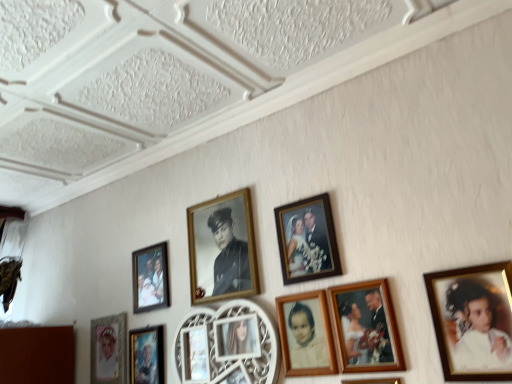
How much space does metallic silver portrait at lower left, the sixth picture frame when ordered from right to left, occupy vertically?

8.64 inches.

Describe the element at coordinates (373, 381) in the screenshot. This screenshot has height=384, width=512. I see `wooden photo frame at lower center, the first picture frame in the right-to-left sequence` at that location.

The height and width of the screenshot is (384, 512). In order to click on gold-framed photo at center, which ranks as the 4th picture frame in left-to-right order in this screenshot , I will do `click(222, 248)`.

What do you see at coordinates (477, 327) in the screenshot?
I see `matte gold frame at upper right` at bounding box center [477, 327].

What do you see at coordinates (247, 340) in the screenshot?
I see `white wood photo frame at center, acting as the fourth picture frame starting from the right` at bounding box center [247, 340].

Where is `white wood photo frame at center, the 5th picture frame when ordered from left to right`? The image size is (512, 384). white wood photo frame at center, the 5th picture frame when ordered from left to right is located at coordinates pyautogui.click(x=247, y=340).

Image resolution: width=512 pixels, height=384 pixels. I want to click on metallic silver portrait at lower left, the sixth picture frame when ordered from right to left, so click(146, 355).

Is point (391, 382) closer or farther from the camera than point (401, 362)?

Point (391, 382) is farther from the camera than point (401, 362).

From the image's perspective, would you say wooden photo frame at lower center, the 8th picture frame viewed from the left, is positioned over wooden photo frame at center, which is the 7th picture frame in left-to-right order?

No, from the image's perspective, wooden photo frame at lower center, the 8th picture frame viewed from the left, is not above wooden photo frame at center, which is the 7th picture frame in left-to-right order.

Which object is closer to the camera taking this photo, wooden photo frame at lower center, the first picture frame in the right-to-left sequence, or wooden photo frame at center, which is the 7th picture frame in left-to-right order?

Positioned in front is wooden photo frame at lower center, the first picture frame in the right-to-left sequence.

Which is nearer, (467, 280) or (257, 308)?

Point (467, 280) appears to be closer to the viewer than point (257, 308).

Based on their positions, is matte gold frame at upper right located to the left or right of white wood photo frame at center, acting as the fourth picture frame starting from the right?

matte gold frame at upper right is to the right of white wood photo frame at center, acting as the fourth picture frame starting from the right.

Consider the image. Looking at their sizes, would you say matte gold frame at upper right is wider or thinner than white wood photo frame at center, acting as the fourth picture frame starting from the right?

Clearly, matte gold frame at upper right has less width compared to white wood photo frame at center, acting as the fourth picture frame starting from the right.

Which object is wider, wooden photo frame at lower center, the first picture frame in the right-to-left sequence, or matte wooden picture frame at lower left, which appears as the second picture frame when viewed from the left?

matte wooden picture frame at lower left, which appears as the second picture frame when viewed from the left, is wider.

Is wooden photo frame at lower center, the 8th picture frame viewed from the left, positioned with its back to matte wooden picture frame at lower left, placed as the seventh picture frame when sorted from right to left?

wooden photo frame at lower center, the 8th picture frame viewed from the left, does not have its back to matte wooden picture frame at lower left, placed as the seventh picture frame when sorted from right to left.

Would you say wooden photo frame at lower center, the first picture frame in the right-to-left sequence, contains matte wooden picture frame at lower left, placed as the seventh picture frame when sorted from right to left?

That's incorrect, matte wooden picture frame at lower left, placed as the seventh picture frame when sorted from right to left, is not inside wooden photo frame at lower center, the first picture frame in the right-to-left sequence.

Where is `picture frame that is the 6th object to the right of the matte wooden picture frame at lower left, placed as the seventh picture frame when sorted from right to left, starting at the anchor`? This screenshot has width=512, height=384. picture frame that is the 6th object to the right of the matte wooden picture frame at lower left, placed as the seventh picture frame when sorted from right to left, starting at the anchor is located at coordinates (373, 381).

In terms of height, does matte wooden picture frame at lower left, placed as the seventh picture frame when sorted from right to left, look taller or shorter compared to wooden photo frame at center, which ranks as the 2th picture frame in right-to-left order?

matte wooden picture frame at lower left, placed as the seventh picture frame when sorted from right to left, is taller than wooden photo frame at center, which ranks as the 2th picture frame in right-to-left order.

Is matte wooden picture frame at lower left, which appears as the second picture frame when viewed from the left, oriented away from wooden photo frame at center, which is the 7th picture frame in left-to-right order?

That's not correct — matte wooden picture frame at lower left, which appears as the second picture frame when viewed from the left, is not looking away from wooden photo frame at center, which is the 7th picture frame in left-to-right order.

Looking at this image, from a real-world perspective, is matte wooden picture frame at lower left, which appears as the second picture frame when viewed from the left, located higher than wooden photo frame at center, which is the 7th picture frame in left-to-right order?

Yes, from a real-world perspective, matte wooden picture frame at lower left, which appears as the second picture frame when viewed from the left, is above wooden photo frame at center, which is the 7th picture frame in left-to-right order.

Is wooden photo frame at center, which ranks as the 2th picture frame in right-to-left order, thinner than matte wooden picture frame at lower left, which appears as the second picture frame when viewed from the left?

Yes.

Based on their sizes in the image, would you say wooden photo frame at center, which ranks as the 2th picture frame in right-to-left order, is bigger or smaller than matte wooden picture frame at lower left, placed as the seventh picture frame when sorted from right to left?

Clearly, wooden photo frame at center, which ranks as the 2th picture frame in right-to-left order, is smaller in size than matte wooden picture frame at lower left, placed as the seventh picture frame when sorted from right to left.

Which object is more forward, wooden photo frame at center, which ranks as the 2th picture frame in right-to-left order, or matte wooden picture frame at lower left, which appears as the second picture frame when viewed from the left?

Positioned in front is wooden photo frame at center, which ranks as the 2th picture frame in right-to-left order.

Is point (295, 263) farther from camera compared to point (110, 355)?

No, (295, 263) is in front of (110, 355).

How many degrees apart are the facing directions of wooden photo frame at upper center, which is counted as the 6th picture frame, starting from the left, and matte gold picture frame at lower left, marked as the eighth picture frame in a right-to-left arrangement?

wooden photo frame at upper center, which is counted as the 6th picture frame, starting from the left, and matte gold picture frame at lower left, marked as the eighth picture frame in a right-to-left arrangement, are facing 0.000223 degrees away from each other.

From a real-world perspective, between wooden photo frame at upper center, which is counted as the 6th picture frame, starting from the left, and matte gold picture frame at lower left, marked as the eighth picture frame in a right-to-left arrangement, who is vertically lower?

matte gold picture frame at lower left, marked as the eighth picture frame in a right-to-left arrangement, is physically lower.

Which is more to the right, wooden photo frame at upper center, which is counted as the 6th picture frame, starting from the left, or matte gold picture frame at lower left, marked as the first picture frame in a left-to-right arrangement?

wooden photo frame at upper center, which is counted as the 6th picture frame, starting from the left.

Is point (94, 363) less distant than point (378, 382)?

No.

Who is bigger, matte gold picture frame at lower left, marked as the first picture frame in a left-to-right arrangement, or wooden photo frame at lower center, the 8th picture frame viewed from the left?

matte gold picture frame at lower left, marked as the first picture frame in a left-to-right arrangement.

Which object is thinner, matte gold picture frame at lower left, marked as the eighth picture frame in a right-to-left arrangement, or wooden photo frame at lower center, the first picture frame in the right-to-left sequence?

wooden photo frame at lower center, the first picture frame in the right-to-left sequence, is thinner.

The height and width of the screenshot is (384, 512). Identify the location of picture frame that appears on the right of wooden photo frame at center, which ranks as the 2th picture frame in right-to-left order. (373, 381).

From the image's perspective, starting from the matte gold frame at upper right, which picture frame is the 3rd one below? Please provide its 2D coordinates.

[(247, 340)]

Considering their positions, is metallic silver portrait at lower left, the sixth picture frame when ordered from right to left, positioned closer to matte gold picture frame at lower left, marked as the eighth picture frame in a right-to-left arrangement, than gold-framed photo at center, positioned as the 5th picture frame in right-to-left order?

metallic silver portrait at lower left, the sixth picture frame when ordered from right to left, is closer to matte gold picture frame at lower left, marked as the eighth picture frame in a right-to-left arrangement.

When comparing their distances from wooden photo frame at upper center, which is counted as the 6th picture frame, starting from the left, does white wood photo frame at center, acting as the fourth picture frame starting from the right, or gold-framed photo at center, positioned as the 5th picture frame in right-to-left order, seem closer?

Among the two, gold-framed photo at center, positioned as the 5th picture frame in right-to-left order, is located nearer to wooden photo frame at upper center, which is counted as the 6th picture frame, starting from the left.

Looking at the image, which one is located closer to wooden photo frame at center, which is the 7th picture frame in left-to-right order, matte wooden picture frame at lower left, which appears as the second picture frame when viewed from the left, or matte gold frame at upper right?

matte gold frame at upper right lies closer to wooden photo frame at center, which is the 7th picture frame in left-to-right order, than the other object.

Estimate the real-world distances between objects in this image. Which object is further from white wood photo frame at center, acting as the fourth picture frame starting from the right, wooden photo frame at center, which is the 7th picture frame in left-to-right order, or wooden photo frame at lower center, the 8th picture frame viewed from the left?

The object further to white wood photo frame at center, acting as the fourth picture frame starting from the right, is wooden photo frame at lower center, the 8th picture frame viewed from the left.

When comparing their distances from matte wooden picture frame at lower left, placed as the seventh picture frame when sorted from right to left, does wooden photo frame at upper center, the third picture frame in the right-to-left sequence, or white wood photo frame at center, acting as the fourth picture frame starting from the right, seem further?

Among the two, wooden photo frame at upper center, the third picture frame in the right-to-left sequence, is located further to matte wooden picture frame at lower left, placed as the seventh picture frame when sorted from right to left.

Which object lies nearer to the anchor point matte wooden picture frame at lower left, which appears as the second picture frame when viewed from the left, wooden photo frame at lower center, the 8th picture frame viewed from the left, or metallic silver portrait at lower left, the sixth picture frame when ordered from right to left?

Among the two, metallic silver portrait at lower left, the sixth picture frame when ordered from right to left, is located nearer to matte wooden picture frame at lower left, which appears as the second picture frame when viewed from the left.

When comparing their distances from gold-framed photo at center, which ranks as the 4th picture frame in left-to-right order, does matte wooden picture frame at lower left, which appears as the second picture frame when viewed from the left, or matte gold frame at upper right seem closer?

The object closer to gold-framed photo at center, which ranks as the 4th picture frame in left-to-right order, is matte wooden picture frame at lower left, which appears as the second picture frame when viewed from the left.

From the image, which object appears to be farther from matte gold frame at upper right, wooden photo frame at center, which ranks as the 2th picture frame in right-to-left order, or gold-framed photo at center, positioned as the 5th picture frame in right-to-left order?

gold-framed photo at center, positioned as the 5th picture frame in right-to-left order, lies further to matte gold frame at upper right than the other object.

This screenshot has height=384, width=512. What are the coordinates of `person between wooden photo frame at upper center, which is counted as the 6th picture frame, starting from the left, and wooden photo frame at lower center, the 8th picture frame viewed from the left, in the up-down direction` in the screenshot? It's located at (477, 327).